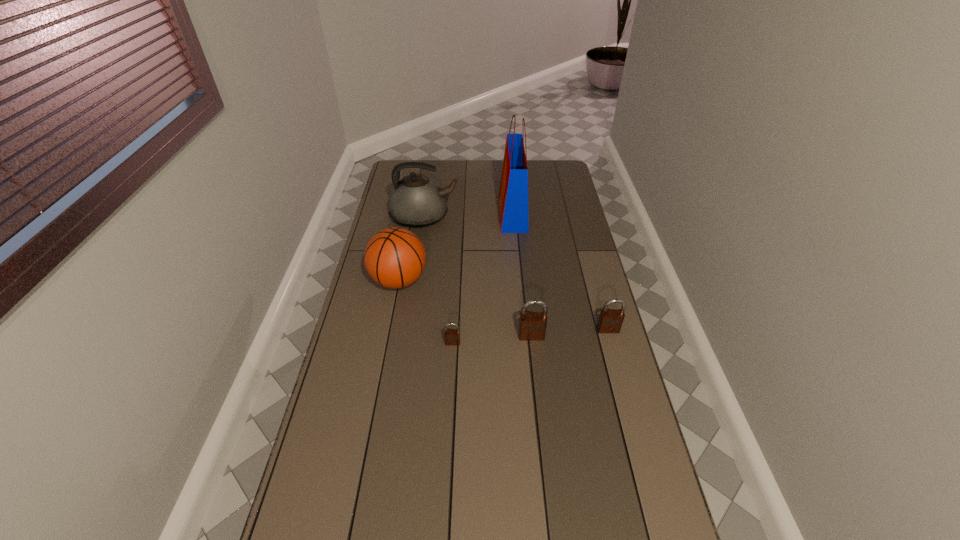
In order to click on vacant position at the near edge of the desktop in this screenshot , I will do coord(431,530).

In the image, there is a desktop. Find the location of `blank space at the left edge`. blank space at the left edge is located at coordinates (348, 464).

Identify the location of vacant space at the right edge. Image resolution: width=960 pixels, height=540 pixels. (605, 382).

Locate an element on the screen. The height and width of the screenshot is (540, 960). vacant space at the near right corner of the desktop is located at coordinates (635, 517).

I want to click on unoccupied position between the kettle and the second padlock from right to left, so click(478, 276).

In order to click on free space between the second padlock from left to right and the leftmost padlock in this screenshot , I will do [492, 340].

The width and height of the screenshot is (960, 540). I want to click on free space between the shortest object and the third tallest object, so click(x=426, y=312).

Where is `unoccupied position between the kettle and the shopping bag`? unoccupied position between the kettle and the shopping bag is located at coordinates (468, 215).

At what (x,y) coordinates should I click in order to perform the action: click on vacant space in between the shortest padlock and the tallest object. Please return your answer as a coordinate pair (x, y). The image size is (960, 540). Looking at the image, I should click on (483, 278).

Find the location of a particular element. This screenshot has height=540, width=960. vacant space that's between the third tallest object and the second padlock from left to right is located at coordinates (466, 308).